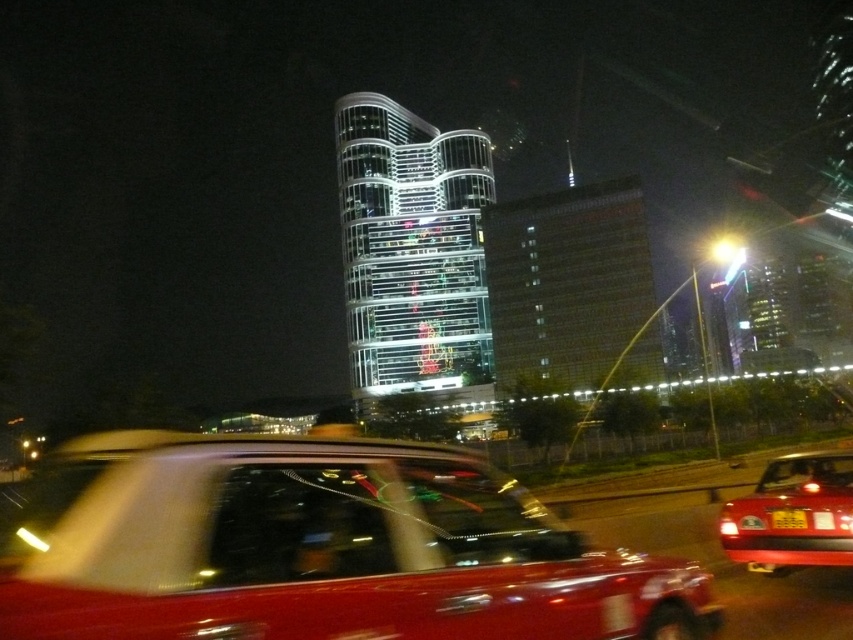
You are a passenger in a car and looking out the window. You see the shiny glass tower at center and the yellow matte license plate at center. Which object is closer to the left side of your view?

The shiny glass tower at center is positioned on the left side of yellow matte license plate at center, so it is closer to the left side of your view.

You are a delivery driver who needs to deliver a package to the glassy reflective building at center. The road ahead is straight and clear. If your vehicle is currently 100 feet away from the building, how much further do you need to drive to reach it?

The glassy reflective building at center is 374.46 feet from the viewer. Since your vehicle is currently 100 feet away, you need to drive an additional 274.46 feet to reach it.